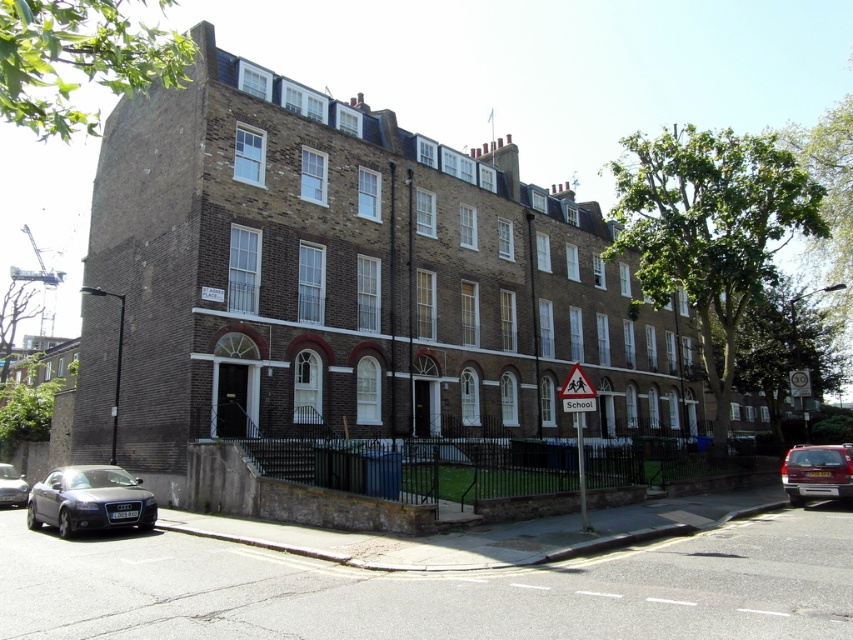
Question: Which point is farther from the camera taking this photo?

Choices:
 (A) (577, 385)
 (B) (793, 451)
 (C) (114, 467)
 (D) (22, 477)

Answer: (D)

Question: Based on their relative distances, which object is farther from the shiny silver car at lower left?

Choices:
 (A) metallic red car at lower right
 (B) matte black car at lower left
 (C) white plastic school sign at lower right

Answer: (A)

Question: Which object is farther from the camera taking this photo?

Choices:
 (A) shiny silver car at lower left
 (B) white plastic triangular at center
 (C) white plastic school sign at lower right
 (D) metallic red car at lower right

Answer: (A)

Question: From the image, what is the correct spatial relationship of matte black car at lower left in relation to white plastic triangular at center?

Choices:
 (A) right
 (B) left

Answer: (B)

Question: Does metallic red car at lower right have a lesser width compared to white plastic triangular at center?

Choices:
 (A) no
 (B) yes

Answer: (A)

Question: Does white plastic triangular at center appear on the left side of shiny silver car at lower left?

Choices:
 (A) no
 (B) yes

Answer: (A)